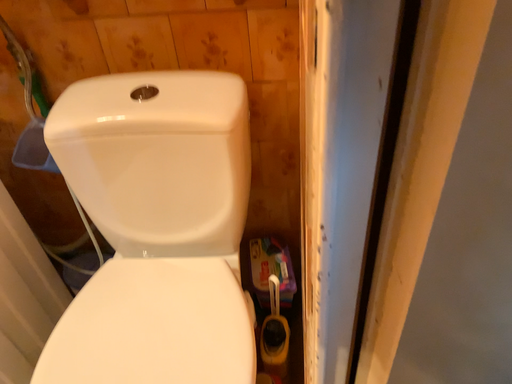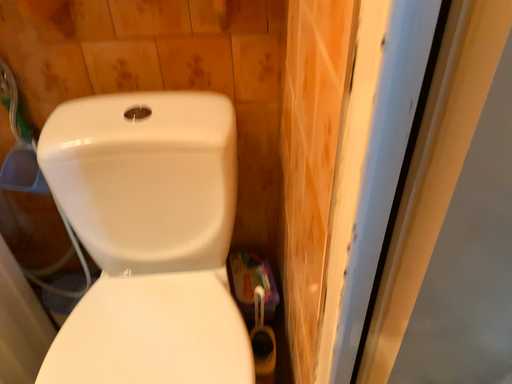
Question: How did the camera likely rotate when shooting the video?

Choices:
 (A) rotated right
 (B) rotated left

Answer: (A)